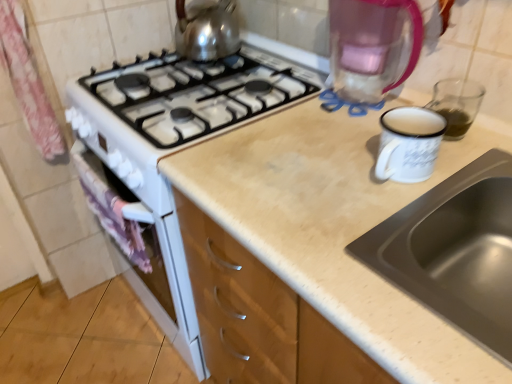
Question: In terms of height, does pink fabric at left look taller or shorter compared to stainless steel sink at upper right?

Choices:
 (A) tall
 (B) short

Answer: (A)

Question: From the image's perspective, relative to stainless steel sink at upper right, is pink fabric at left above or below?

Choices:
 (A) below
 (B) above

Answer: (B)

Question: Considering the real-world distances, which object is closest to the stainless steel sink at upper right?

Choices:
 (A) transparent plastic coffeepot at upper right
 (B) green liquid at right
 (C) pink fabric curtain at left
 (D) pink fabric at left
 (E) shiny metallic kettle at upper center

Answer: (B)

Question: Estimate the real-world distances between objects in this image. Which object is farther from the pink fabric at left?

Choices:
 (A) pink fabric curtain at left
 (B) stainless steel sink at upper right
 (C) green liquid at right
 (D) shiny metallic kettle at upper center
 (E) transparent plastic coffeepot at upper right

Answer: (C)